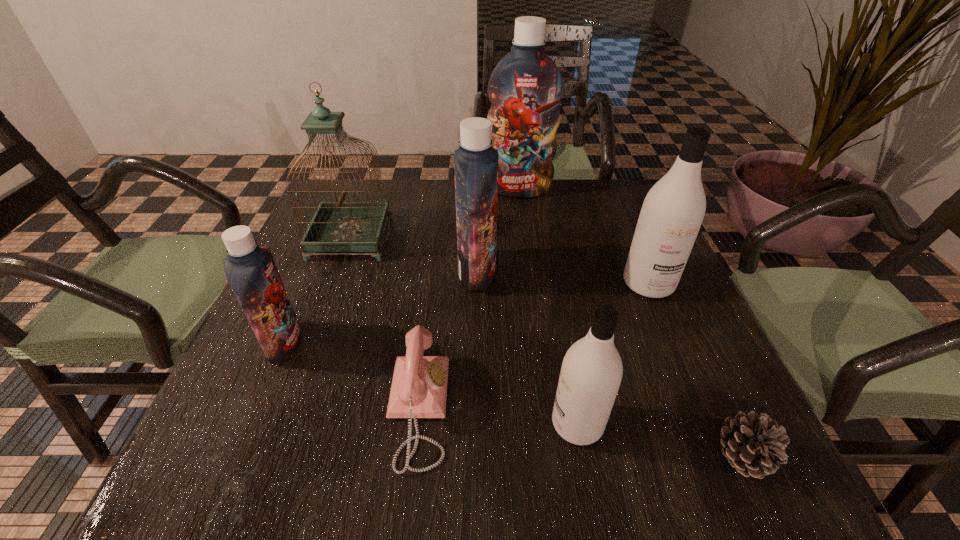
Where is `free space located on the front-facing side of the left white shampoo`? free space located on the front-facing side of the left white shampoo is located at coordinates (456, 423).

I want to click on free location located 0.050m on the dial of the pink telephone, so click(476, 409).

This screenshot has width=960, height=540. I want to click on vacant space located on the left of the pinecone, so click(x=676, y=456).

Locate an element on the screen. shampoo that is at the far edge is located at coordinates tap(525, 88).

You are a GUI agent. You are given a task and a screenshot of the screen. Output one action in this format:
    pyautogui.click(x=<x>, y=<y>)
    Task: Click on the birdcage at the far edge
    
    Given the screenshot: What is the action you would take?
    pyautogui.click(x=339, y=226)

Find the location of a particular element. shampoo that is at the near edge is located at coordinates (591, 372).

The width and height of the screenshot is (960, 540). I want to click on telephone that is at the near edge, so click(x=419, y=386).

You are a GUI agent. You are given a task and a screenshot of the screen. Output one action in this format:
    pyautogui.click(x=<x>, y=<y>)
    Task: Click on the pinecone that is at the near edge
    The image size is (960, 540).
    Given the screenshot: What is the action you would take?
    pyautogui.click(x=755, y=445)

Find the location of a particular element. birdcage that is at the left edge is located at coordinates (339, 226).

The width and height of the screenshot is (960, 540). I want to click on shampoo that is at the left edge, so click(x=250, y=269).